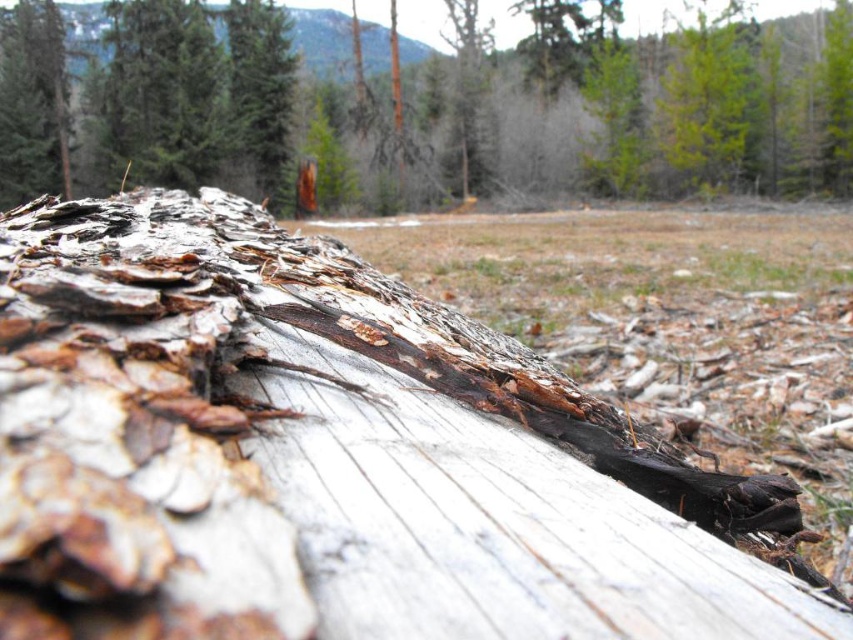
You are a hiker who just found a treasure map. The map says the treasure is buried at point (332,456) on the tree trunk. The treasure requires a wooden stake to mark the spot. Based on the scene, is the point on weathered wood at center suitable for driving a wooden stake?

The point (332,456) is on weathered wood at center, which is part of the decaying tree trunk. Since the tree trunk is already decaying and has peeling bark, driving a wooden stake into it may not be stable or advisable as the wood is likely soft and compromised.